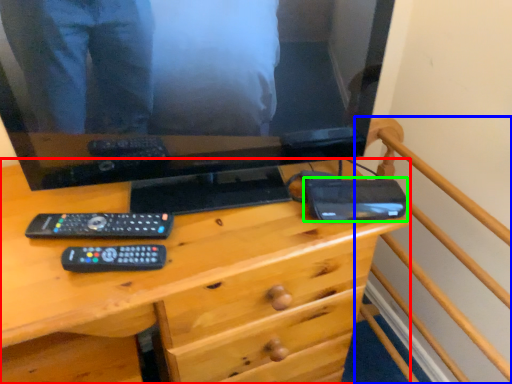
Question: Considering the real-world distances, which object is closest to desk (highlighted by a red box)? bed frame (highlighted by a blue box) or gadget (highlighted by a green box).

Choices:
 (A) bed frame
 (B) gadget

Answer: (B)